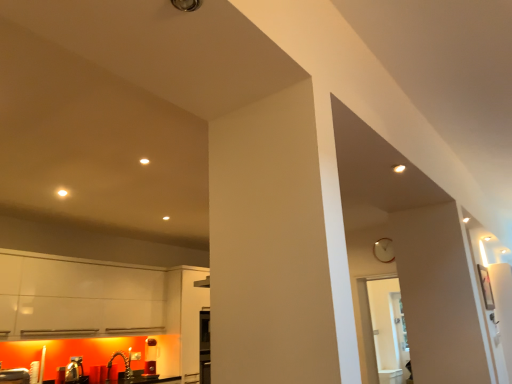
Question: From a real-world perspective, relative to transparent glass door at center, is wooden clock at upper right vertically above or below?

Choices:
 (A) above
 (B) below

Answer: (A)

Question: Looking at their shapes, would you say wooden clock at upper right is wider or thinner than transparent glass door at center?

Choices:
 (A) thin
 (B) wide

Answer: (A)

Question: Which object is positioned farthest from the transparent glass door at center?

Choices:
 (A) brushed metal sink at lower left
 (B) wooden clock at upper right

Answer: (A)

Question: Which is farther from the transparent glass door at center?

Choices:
 (A) wooden clock at upper right
 (B) brushed metal sink at lower left

Answer: (B)